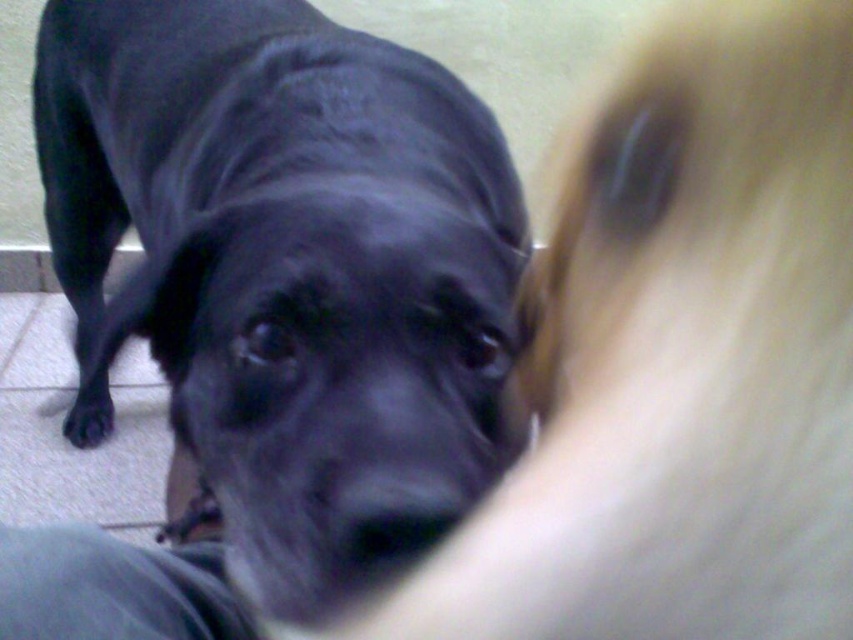
Question: Does black smooth dog at center appear over gray fabric at lower left?

Choices:
 (A) yes
 (B) no

Answer: (A)

Question: Which point is farther from the camera taking this photo?

Choices:
 (A) (68, 540)
 (B) (297, 513)
 (C) (100, 396)

Answer: (C)

Question: Is black smooth dog at center closer to camera compared to gray fabric at lower left?

Choices:
 (A) yes
 (B) no

Answer: (A)

Question: Can you confirm if black smooth dog at center is positioned above black matte paw at lower left?

Choices:
 (A) yes
 (B) no

Answer: (A)

Question: Which object appears closest to the camera in this image?

Choices:
 (A) black smooth dog at center
 (B) gray fabric at lower left
 (C) black matte paw at lower left

Answer: (A)

Question: Which point is closer to the camera?

Choices:
 (A) (80, 404)
 (B) (79, 616)
 (C) (86, 259)

Answer: (B)